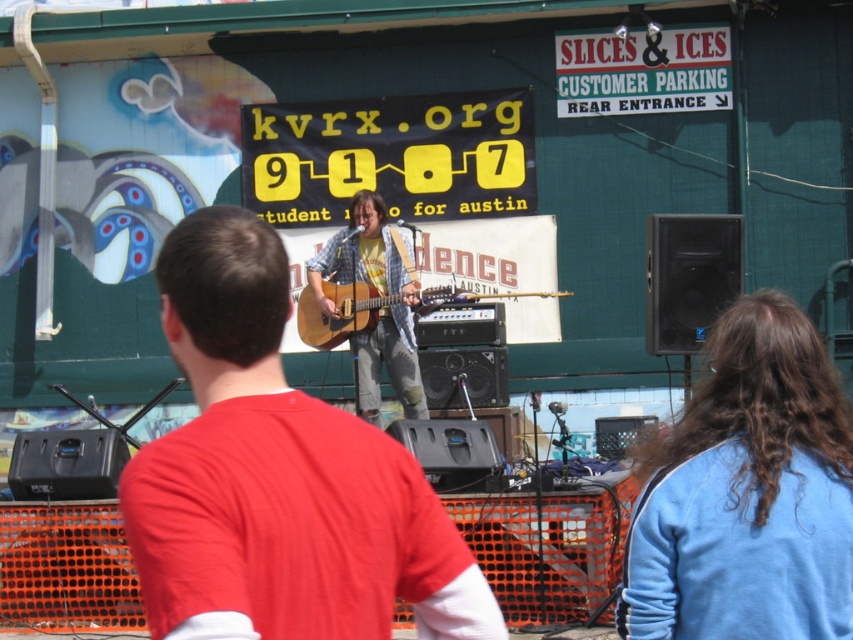
You are standing at the point labeled as point (x=425, y=296) and want to move towards the stage. There is an obstacle at point (x=281, y=444). Can you walk directly towards the stage without going around the obstacle?

Point (x=281, y=444) is in front of point (x=425, y=296), so you cannot walk directly towards the stage without going around the obstacle at point (x=281, y=444).

You are a stagehand who needs to move the matte brown guitar at center and the acoustic wood guitar at center closer together. The venue requires that the guitars must be no more than 5 meters apart. Can you achieve this by moving both guitars towards each other?

The current distance between the matte brown guitar at center and the acoustic wood guitar at center is 8.20 meters. To meet the venue requirement of 5 meters apart, you need to reduce the distance by 3.20 meters. Since both guitars can be moved towards each other, this adjustment is possible. Move each guitar 1.60 meters toward the other to achieve the required distance.